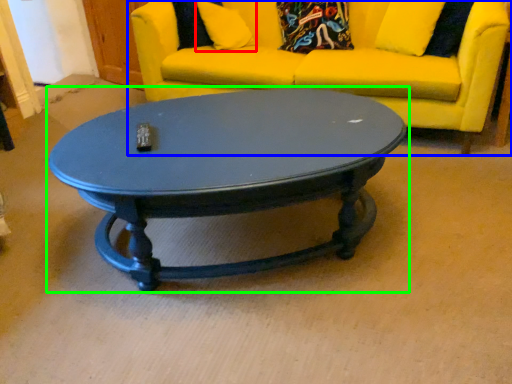
Question: Which object is positioned farthest from pillow (highlighted by a red box)? Select from studio couch (highlighted by a blue box) and coffee table (highlighted by a green box).

Choices:
 (A) studio couch
 (B) coffee table

Answer: (B)